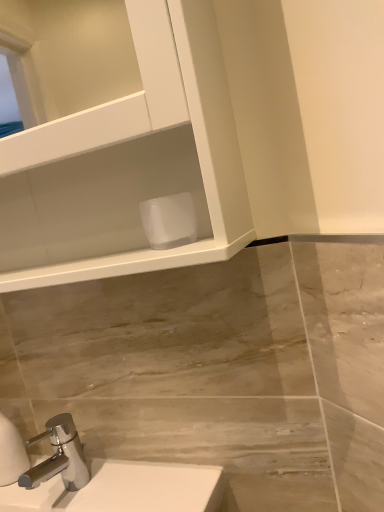
Question: Is chrome metallic faucet at lower left inside the boundaries of white matte toilet paper at lower center, or outside?

Choices:
 (A) inside
 (B) outside

Answer: (B)

Question: Is chrome metallic faucet at lower left wider or thinner than white matte toilet paper at lower center?

Choices:
 (A) thin
 (B) wide

Answer: (B)

Question: From a real-world perspective, is chrome metallic faucet at lower left positioned above or below white matte toilet paper at lower center?

Choices:
 (A) above
 (B) below

Answer: (B)

Question: Relative to chrome metallic faucet at lower left, is white matte toilet paper at lower center in front or behind?

Choices:
 (A) front
 (B) behind

Answer: (A)

Question: From the image's perspective, is white matte toilet paper at lower center located above or below chrome metallic faucet at lower left?

Choices:
 (A) below
 (B) above

Answer: (B)

Question: From their relative heights in the image, would you say white matte toilet paper at lower center is taller or shorter than chrome metallic faucet at lower left?

Choices:
 (A) tall
 (B) short

Answer: (B)

Question: Does point (155, 232) appear closer or farther from the camera than point (72, 441)?

Choices:
 (A) closer
 (B) farther

Answer: (A)